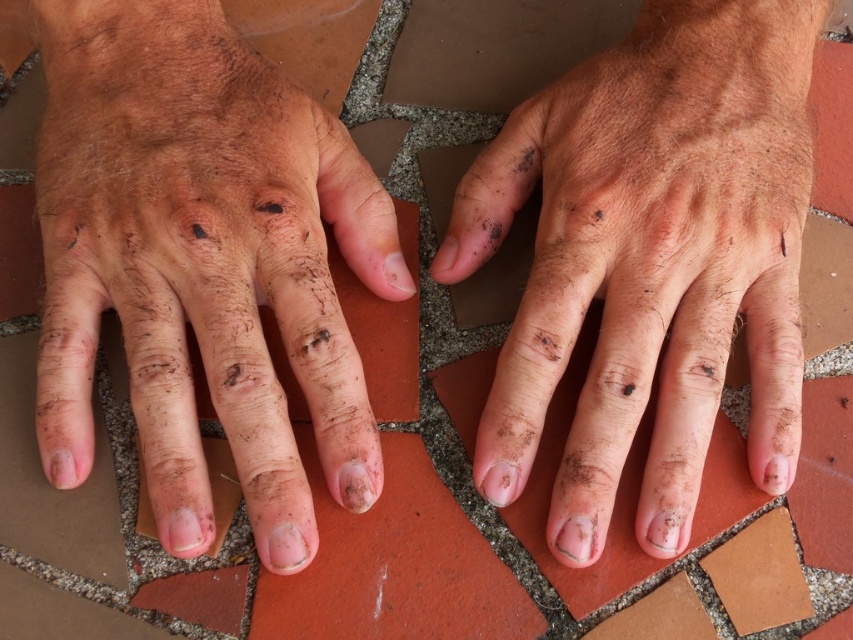
You are a dermatologist examining the hands in the image. You notice two areas of concern labeled as dry skin at center and dirty skin hand at center. Which area is located lower on the hand?

The dry skin at center is located lower on the hand because it is below the dirty skin hand at center.

You are a skincare specialist examining a client. The client has dry skin at center. You need to apply a moisturizer that requires a 30 inch distance for proper application. Can you apply it from your current position?

The dry skin at center and viewer are 27.77 inches apart. Since the required distance is 30 inches, you are too close to apply the moisturizer properly. Move back approximately 2.23 inches to achieve the correct distance.